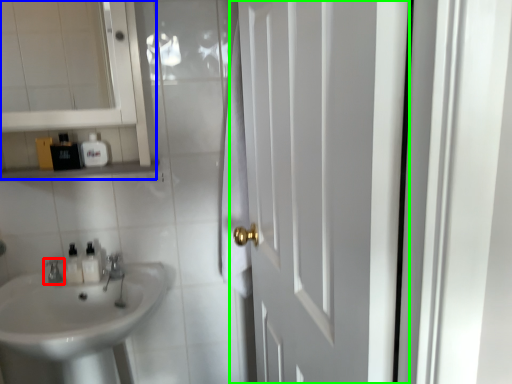
Question: Which is farther away from tap (highlighted by a red box)? medicine cabinet (highlighted by a blue box) or door (highlighted by a green box)?

Choices:
 (A) medicine cabinet
 (B) door

Answer: (B)